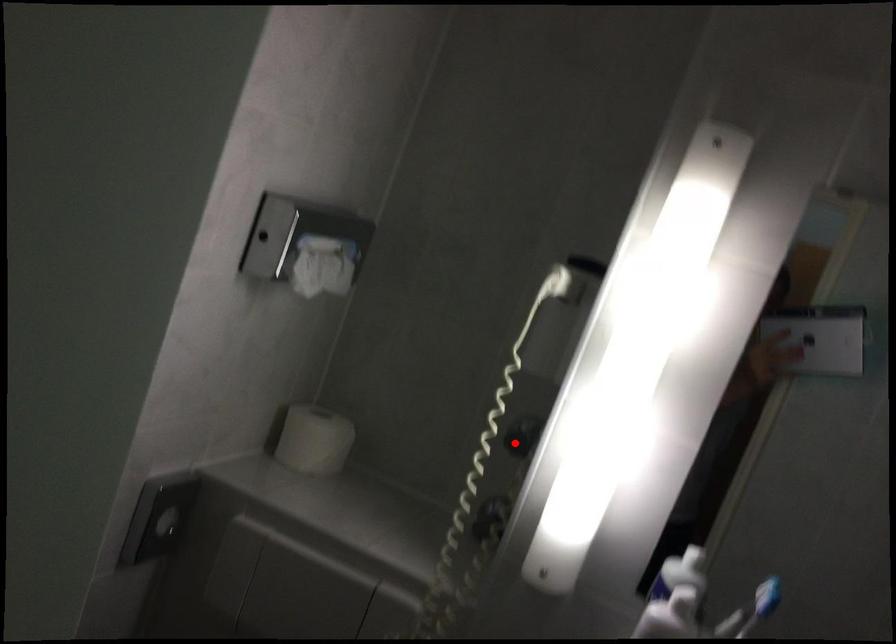
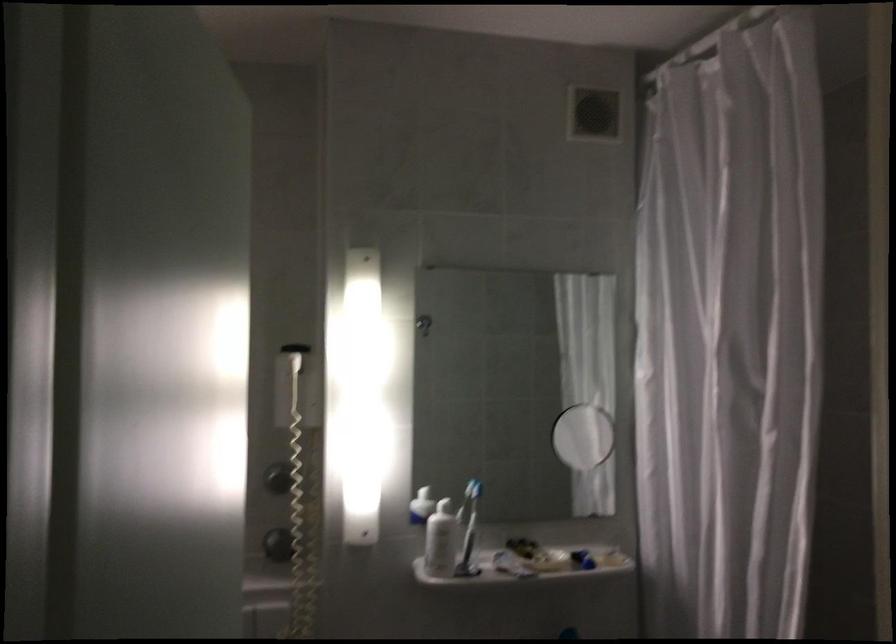
Question: I am providing you with two images of the same scene from different viewpoints. Image1 has a red point marked. In image2, the corresponding 3D location appears at what relative position? Reply with the corresponding letter.

Choices:
 (A) Closer
 (B) Farther

Answer: (B)